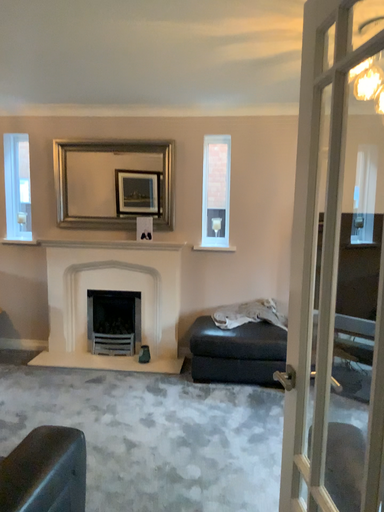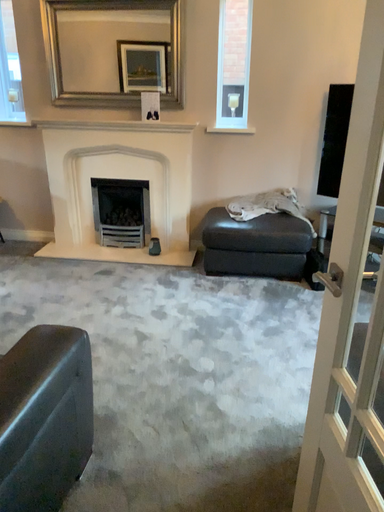
Question: Which way did the camera rotate in the video?

Choices:
 (A) rotated downward
 (B) rotated upward

Answer: (A)